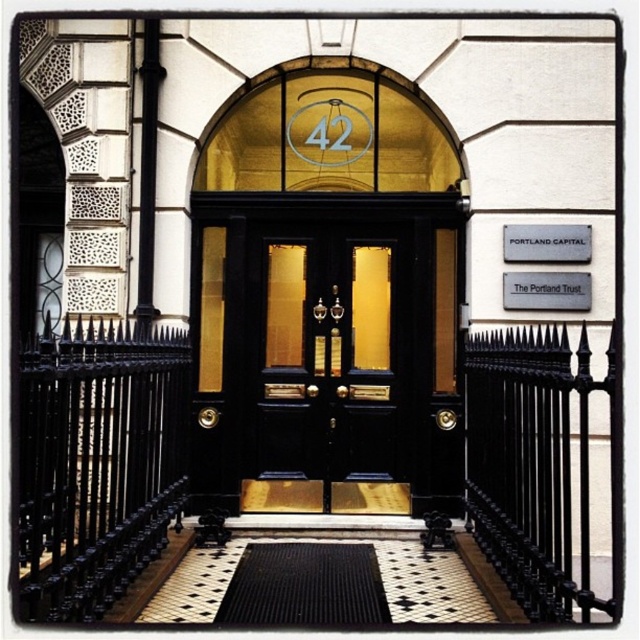
You are a delivery person with a large box that is 3 feet wide. You need to carry it through the entrance. Can you pass through the space between the matte black door at center and the black rubber doormat at center?

The matte black door at center might be wider than black rubber doormat at center, so there might not be enough space for the 3 feet wide box to pass through safely. It is recommended to check the exact dimensions before attempting to move the box through.